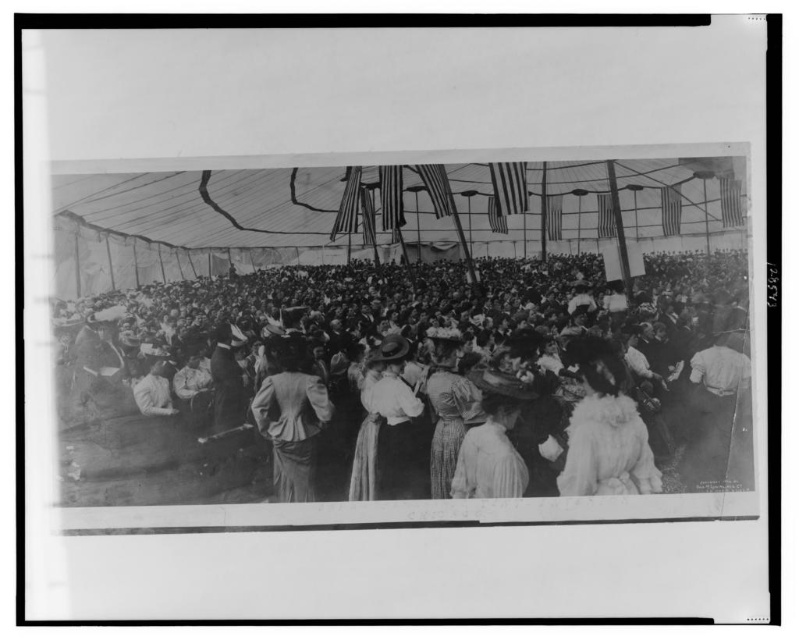
You are standing at the entrance of the tent and want to reach the point marked as point [173,433] in the image. If your walking speed is 3 feet per second, how many seconds will it take you to reach that point?

The distance between you and point [173,433] is 16.18 feet. At a speed of 3 feet per second, it will take approximately 5.39 seconds to reach the point.

You are standing at the entrance of the tent and see two points marked in the image. Which point is closer to you, point [501,276] or point [599,492]?

Point [501,276] is closer to you because it is further to the camera than point [599,492].